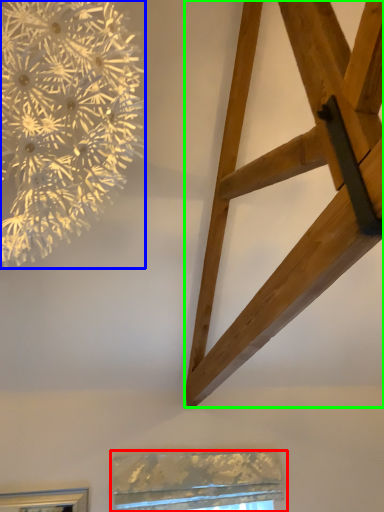
Question: Which is nearer to the window (highlighted by a red box)? flower (highlighted by a blue box) or furniture (highlighted by a green box).

Choices:
 (A) flower
 (B) furniture

Answer: (B)